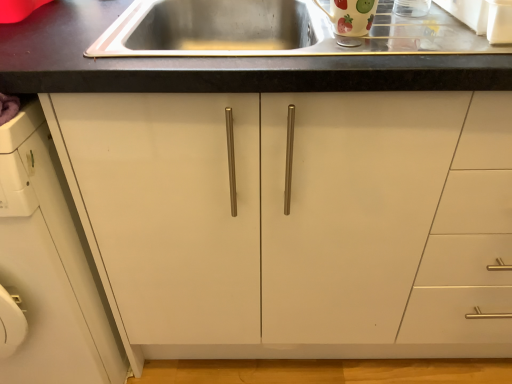
The height and width of the screenshot is (384, 512). Find the location of `free space in front of glossy ceramic mug at upper center`. free space in front of glossy ceramic mug at upper center is located at coordinates (357, 53).